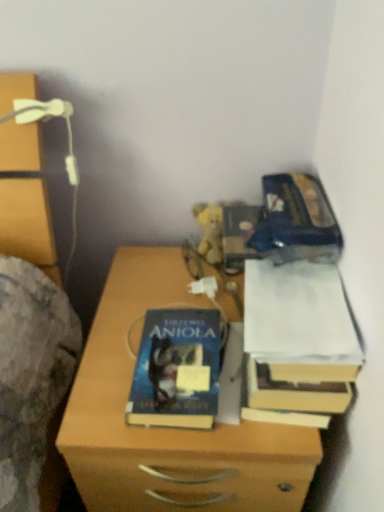
The width and height of the screenshot is (384, 512). I want to click on free spot to the left of white paper at right, so click(x=140, y=329).